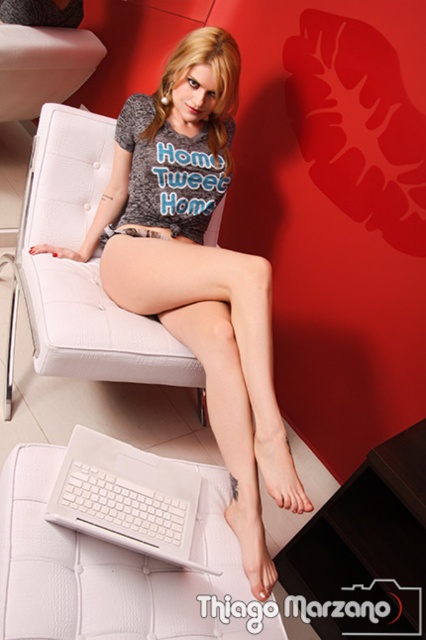
Can you confirm if white leather daybed at center is thinner than white plastic laptop at lower center?

In fact, white leather daybed at center might be wider than white plastic laptop at lower center.

Which is in front, point (63, 452) or point (69, 467)?

Point (69, 467)

Which is in front, point (28, 570) or point (137, 529)?

Point (28, 570) is more forward.

You are a GUI agent. You are given a task and a screenshot of the screen. Output one action in this format:
    pyautogui.click(x=<x>, y=<y>)
    Task: Click on the white leather daybed at center
    
    Given the screenshot: What is the action you would take?
    pyautogui.click(x=108, y=570)

Who is shorter, white leather daybed at center or white leather armchair at center?

white leather daybed at center is shorter.

Who is lower down, white leather daybed at center or white leather armchair at center?

white leather daybed at center is lower down.

What are the coordinates of `white leather daybed at center` in the screenshot? It's located at (108, 570).

Where is `white leather daybed at center`? The image size is (426, 640). white leather daybed at center is located at coordinates point(108,570).

Measure the distance between matte gray t-shirt at center and camera.

A distance of 1.21 meters exists between matte gray t-shirt at center and camera.

Can you confirm if matte gray t-shirt at center is positioned above white leather daybed at center?

Yes, matte gray t-shirt at center is above white leather daybed at center.

At what (x,y) coordinates should I click in order to perform the action: click on matte gray t-shirt at center. Please return your answer as a coordinate pair (x, y). The height and width of the screenshot is (640, 426). Looking at the image, I should click on (198, 272).